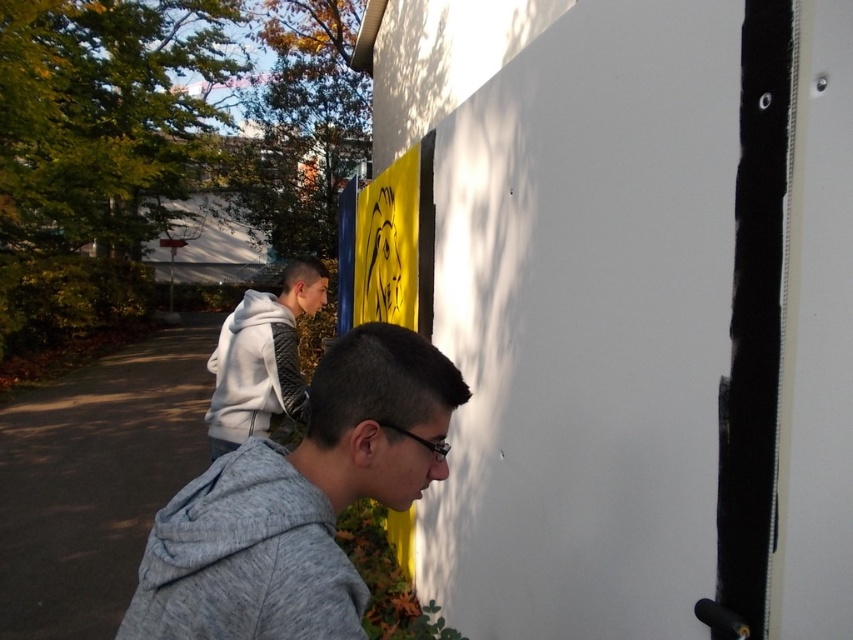
Question: Is gray fleece jacket at lower left below white hoodie at upper left?

Choices:
 (A) no
 (B) yes

Answer: (A)

Question: Which point is farther to the camera?

Choices:
 (A) gray fleece jacket at lower left
 (B) gray heathered sweatshirt at lower left

Answer: (A)

Question: Is gray fleece jacket at lower left behind white hoodie at upper left?

Choices:
 (A) no
 (B) yes

Answer: (A)

Question: Which object is closer to the camera taking this photo?

Choices:
 (A) gray heathered sweatshirt at lower left
 (B) gray fleece jacket at lower left
 (C) white hoodie at upper left

Answer: (A)

Question: Which of the following is the closest to the observer?

Choices:
 (A) (321, 637)
 (B) (299, 420)
 (C) (347, 349)

Answer: (A)

Question: Can you confirm if gray fleece jacket at lower left is wider than white hoodie at upper left?

Choices:
 (A) no
 (B) yes

Answer: (A)